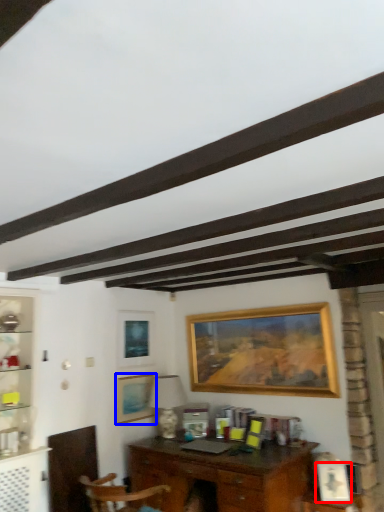
Question: Which point is closer to the camera, picture frame (highlighted by a red box) or picture frame (highlighted by a blue box)?

Choices:
 (A) picture frame
 (B) picture frame

Answer: (A)